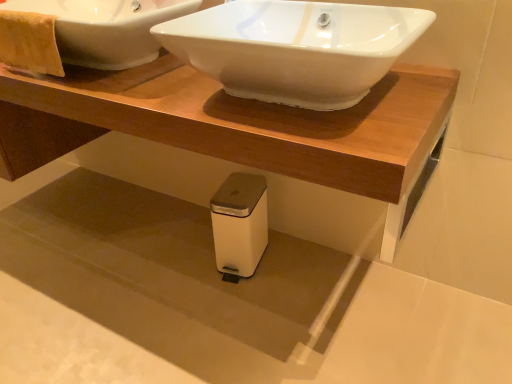
The height and width of the screenshot is (384, 512). Identify the location of vacant region below white plastic trash can at lower center (from a real-world perspective). (178, 258).